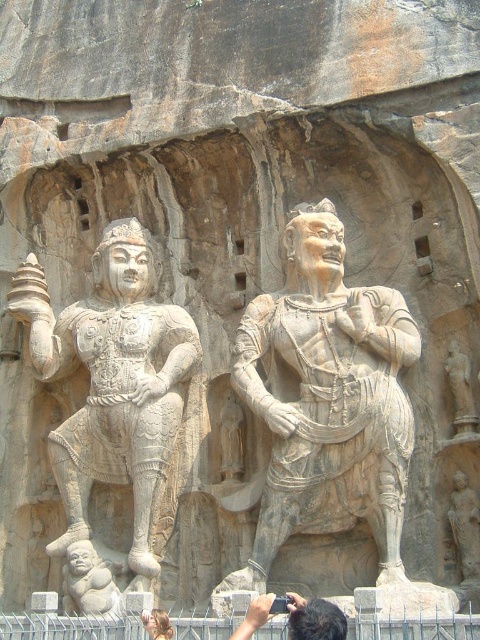
Question: Which point is farther from the camera taking this photo?

Choices:
 (A) (322, 605)
 (B) (96, 593)

Answer: (B)

Question: Which is farther from the stone warrior at center?

Choices:
 (A) smooth stone baby at lower left
 (B) light brown hair at lower center

Answer: (A)

Question: Can you confirm if white stone warrior at left is positioned below light brown hair at lower center?

Choices:
 (A) yes
 (B) no

Answer: (B)

Question: Which of the following is the closest to the observer?

Choices:
 (A) (67, 612)
 (B) (158, 614)
 (C) (465, 500)

Answer: (B)

Question: Can you confirm if stone warrior at center is thinner than light brown hair at lower center?

Choices:
 (A) no
 (B) yes

Answer: (A)

Question: In this image, where is white stone warrior at left located relative to smooth gray statue at center?

Choices:
 (A) right
 (B) left

Answer: (B)